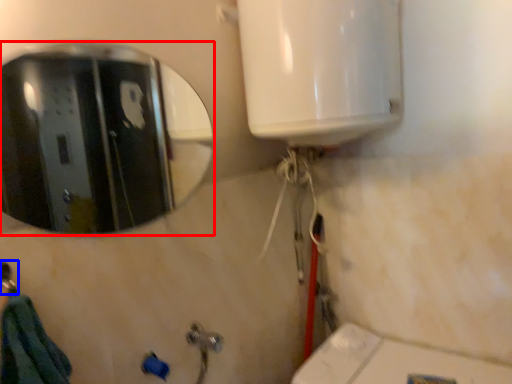
Question: Which point is further to the camera, mirror (highlighted by a red box) or shower (highlighted by a blue box)?

Choices:
 (A) mirror
 (B) shower

Answer: (A)